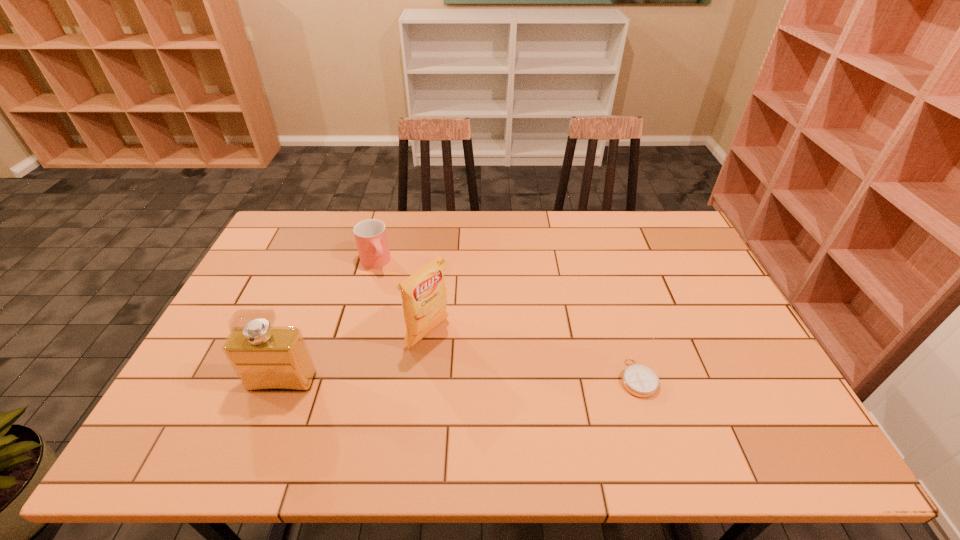
The image size is (960, 540). Find the location of `the leftmost object`. the leftmost object is located at coordinates (266, 359).

Locate an element on the screen. the shortest object is located at coordinates (639, 380).

Identify the location of the rightmost object. The width and height of the screenshot is (960, 540). (639, 380).

Identify the location of the farthest object. This screenshot has width=960, height=540. (370, 235).

Identify the location of cup. (370, 235).

The height and width of the screenshot is (540, 960). Identify the location of the third nearest object. (424, 298).

Locate an element on the screen. This screenshot has width=960, height=540. the third object from left to right is located at coordinates (424, 298).

Locate an element on the screen. The image size is (960, 540). vacant space positioned 0.100m on the back of the compass is located at coordinates (623, 330).

Where is `vacant space located on the side of the farthest object with the handle`? This screenshot has width=960, height=540. vacant space located on the side of the farthest object with the handle is located at coordinates (414, 333).

At what (x,y) coordinates should I click in order to perform the action: click on free space located 0.400m on the side of the farthest object with the handle. Please return your answer as a coordinate pair (x, y). This screenshot has width=960, height=540. Looking at the image, I should click on (432, 363).